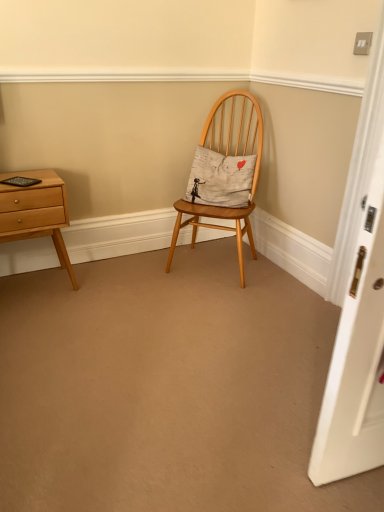
Question: From the image's perspective, is natural wood chair at center over white cotton cushion at center?

Choices:
 (A) yes
 (B) no

Answer: (B)

Question: Is natural wood chair at center at the left side of white cotton cushion at center?

Choices:
 (A) no
 (B) yes

Answer: (A)

Question: From a real-world perspective, is natural wood chair at center positioned under white cotton cushion at center based on gravity?

Choices:
 (A) yes
 (B) no

Answer: (A)

Question: From a real-world perspective, is natural wood chair at center over white cotton cushion at center?

Choices:
 (A) no
 (B) yes

Answer: (A)

Question: Is natural wood chair at center with white cotton cushion at center?

Choices:
 (A) no
 (B) yes

Answer: (B)

Question: Is natural wood chair at center in front of or behind light brown wood nightstand at left in the image?

Choices:
 (A) behind
 (B) front

Answer: (A)

Question: Visually, is natural wood chair at center positioned to the left or to the right of light brown wood nightstand at left?

Choices:
 (A) right
 (B) left

Answer: (A)

Question: Is point (225, 110) closer or farther from the camera than point (21, 220)?

Choices:
 (A) farther
 (B) closer

Answer: (A)

Question: Considering the positions of natural wood chair at center and light brown wood nightstand at left in the image, is natural wood chair at center bigger or smaller than light brown wood nightstand at left?

Choices:
 (A) small
 (B) big

Answer: (B)

Question: In terms of height, does natural wood chair at center look taller or shorter compared to white cotton cushion at center?

Choices:
 (A) short
 (B) tall

Answer: (B)

Question: Considering their positions, is natural wood chair at center located in front of or behind white cotton cushion at center?

Choices:
 (A) behind
 (B) front

Answer: (B)

Question: From a real-world perspective, is natural wood chair at center above or below white cotton cushion at center?

Choices:
 (A) above
 (B) below

Answer: (B)

Question: Choose the correct answer: Is natural wood chair at center inside white cotton cushion at center or outside it?

Choices:
 (A) inside
 (B) outside

Answer: (B)

Question: In terms of size, does light brown wood nightstand at left appear bigger or smaller than white cotton cushion at center?

Choices:
 (A) big
 (B) small

Answer: (A)

Question: Choose the correct answer: Is light brown wood nightstand at left inside white cotton cushion at center or outside it?

Choices:
 (A) outside
 (B) inside

Answer: (A)